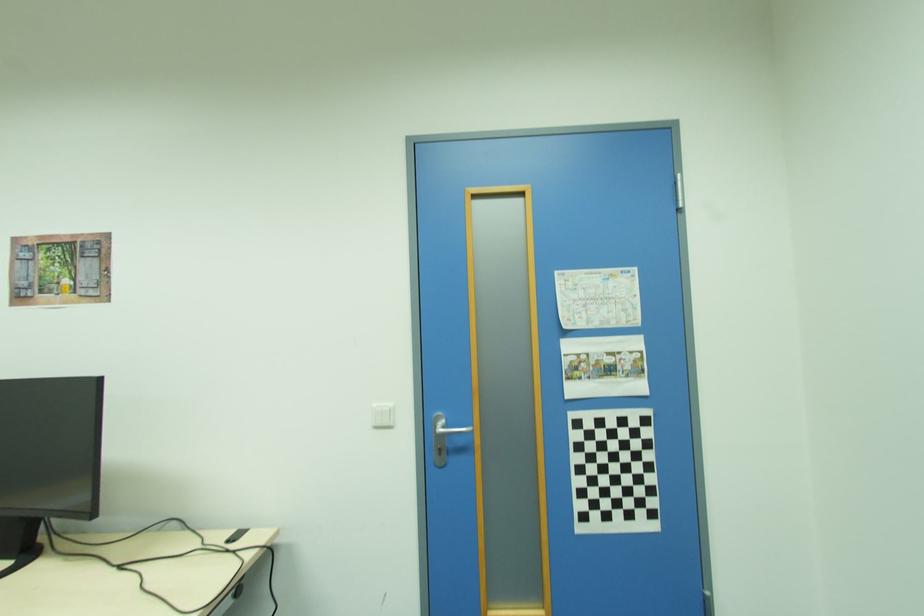
At what (x,y) coordinates should I click in order to perform the action: click on light switch rocker. Please return your answer as a coordinate pair (x, y). Image resolution: width=924 pixels, height=616 pixels. Looking at the image, I should click on (383, 415).